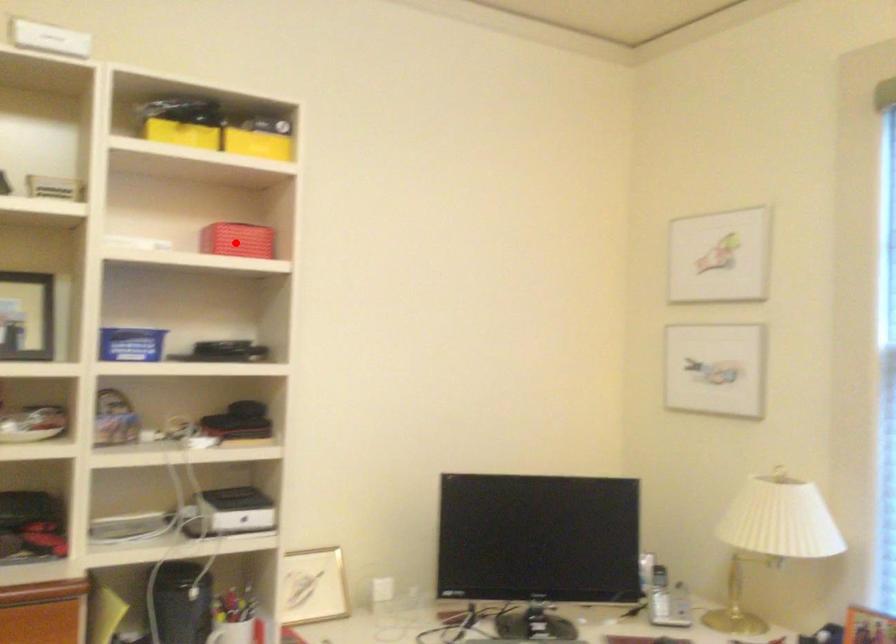
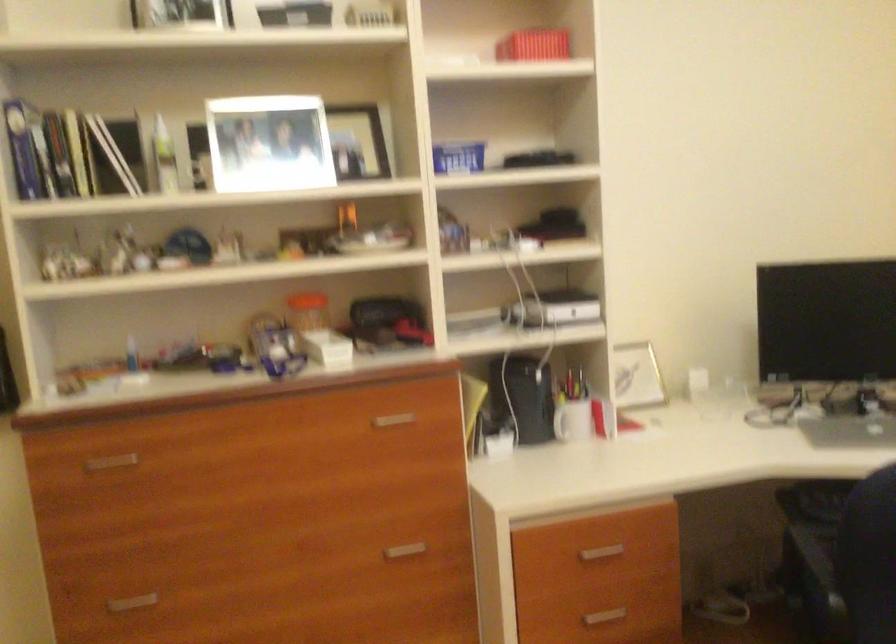
Where in the second image is the point corresponding to the highlighted location from the first image?

(533, 44)